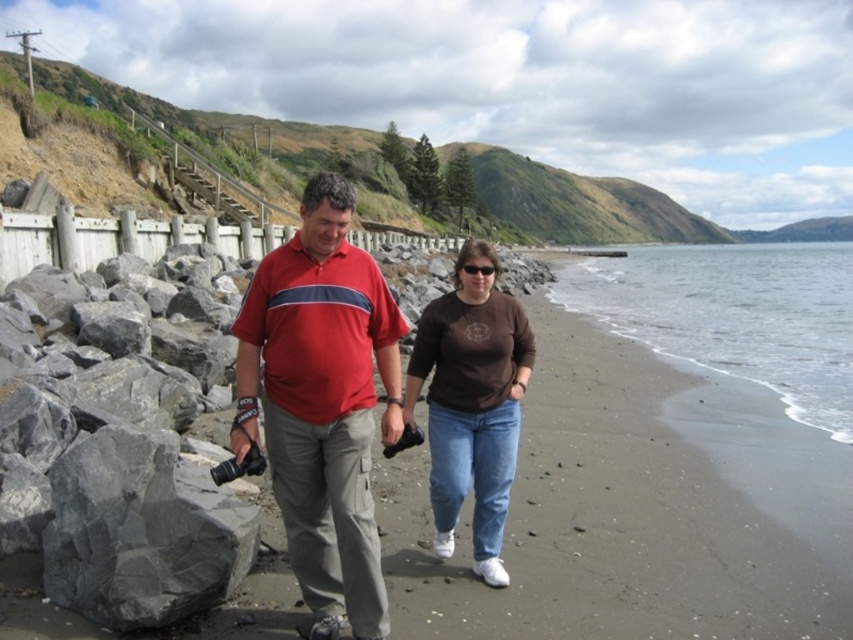
Which of these two, gray rock at lower left or brown matte shirt at center, stands shorter?

Standing shorter between the two is gray rock at lower left.

Is gray rock at lower left to the right of brown matte shirt at center from the viewer's perspective?

In fact, gray rock at lower left is to the left of brown matte shirt at center.

Who is more forward, (x=68, y=522) or (x=434, y=509)?

Point (x=68, y=522) is more forward.

Find the location of a particular element. The width and height of the screenshot is (853, 640). gray rock at lower left is located at coordinates (141, 531).

Between gray sand at lower right and brown matte shirt at center, which one is positioned lower?

brown matte shirt at center

Is gray sand at lower right bigger than brown matte shirt at center?

Indeed, gray sand at lower right has a larger size compared to brown matte shirt at center.

Which is behind, point (828, 320) or point (529, 355)?

Positioned behind is point (828, 320).

At what (x,y) coordinates should I click in order to perform the action: click on gray sand at lower right. Please return your answer as a coordinate pair (x, y). Looking at the image, I should click on (735, 314).

Consider the image. Can you confirm if brown matte shirt at center is wider than black plastic sunglasses at center?

Yes.

Does brown matte shirt at center lie in front of black plastic sunglasses at center?

Yes, it is in front of black plastic sunglasses at center.

Between point (502, 328) and point (491, 273), which one is positioned in front?

Positioned in front is point (502, 328).

Where is `brown matte shirt at center`? brown matte shirt at center is located at coordinates (471, 404).